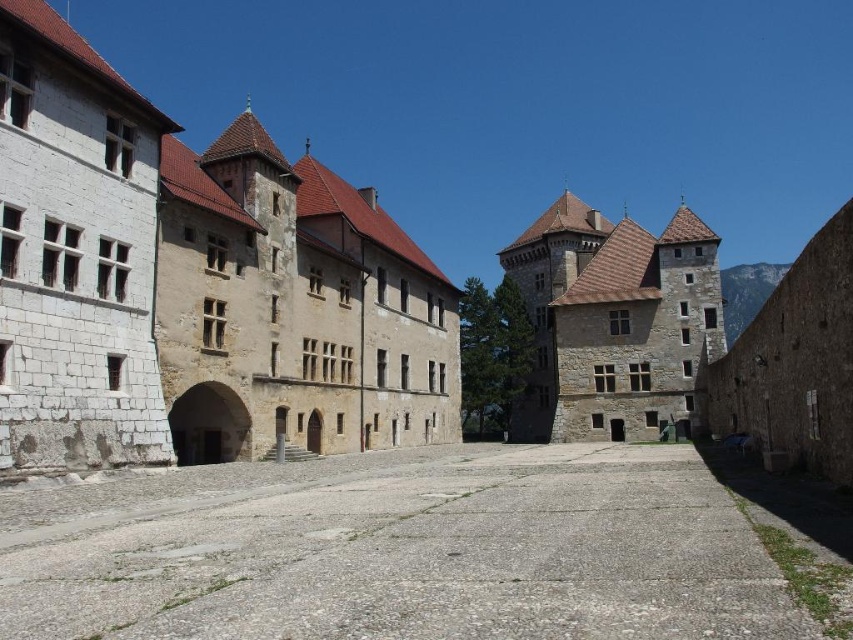
Which is above, white stone building at center or gray concrete alley at center?

white stone building at center is above.

Measure the distance between point (4, 28) and camera.

38.35 meters

The image size is (853, 640). I want to click on white stone building at center, so click(x=195, y=284).

Which is more to the left, white stone building at center or brown stone castle at center?

white stone building at center is more to the left.

Consider the image. Is white stone building at center bigger than brown stone castle at center?

Indeed, white stone building at center has a larger size compared to brown stone castle at center.

The width and height of the screenshot is (853, 640). I want to click on white stone building at center, so click(x=195, y=284).

Is point (68, 580) closer to camera compared to point (659, 241)?

Yes, it is.

Looking at this image, does gray concrete alley at center have a greater width compared to brown stone castle at center?

Indeed, gray concrete alley at center has a greater width compared to brown stone castle at center.

This screenshot has width=853, height=640. Describe the element at coordinates (427, 550) in the screenshot. I see `gray concrete alley at center` at that location.

Locate an element on the screen. This screenshot has width=853, height=640. gray concrete alley at center is located at coordinates (427, 550).